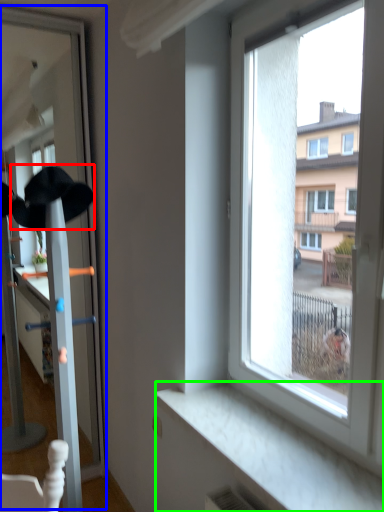
Question: Estimate the real-world distances between objects in this image. Which object is closer to baseball hat (highlighted by a red box), screen door (highlighted by a blue box) or window sill (highlighted by a green box)?

Choices:
 (A) screen door
 (B) window sill

Answer: (A)